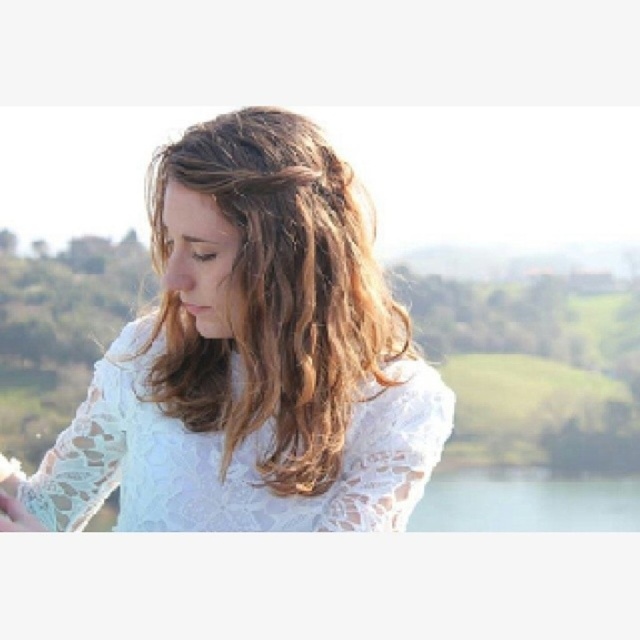
Question: From the image, what is the correct spatial relationship of white lace shirt at center in relation to transparent glass lake at bottom?

Choices:
 (A) below
 (B) above

Answer: (B)

Question: Estimate the real-world distances between objects in this image. Which object is farther from the white lace shirt at center?

Choices:
 (A) white lace dress at center
 (B) transparent glass lake at bottom

Answer: (B)

Question: Is the position of white lace shirt at center more distant than that of transparent glass lake at bottom?

Choices:
 (A) no
 (B) yes

Answer: (A)

Question: Considering the real-world distances, which object is closest to the transparent glass lake at bottom?

Choices:
 (A) white lace shirt at center
 (B) white lace dress at center

Answer: (A)

Question: Is white lace shirt at center above transparent glass lake at bottom?

Choices:
 (A) no
 (B) yes

Answer: (B)

Question: Which object appears closest to the camera in this image?

Choices:
 (A) transparent glass lake at bottom
 (B) white lace dress at center
 (C) white lace shirt at center

Answer: (C)